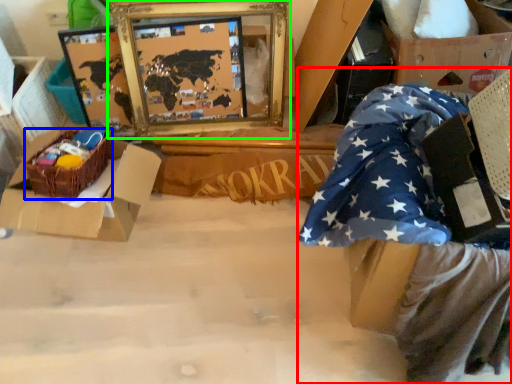
Question: Considering the real-world distances, which object is farthest from person (highlighted by a red box)? crate (highlighted by a blue box) or picture frame (highlighted by a green box)?

Choices:
 (A) crate
 (B) picture frame

Answer: (B)